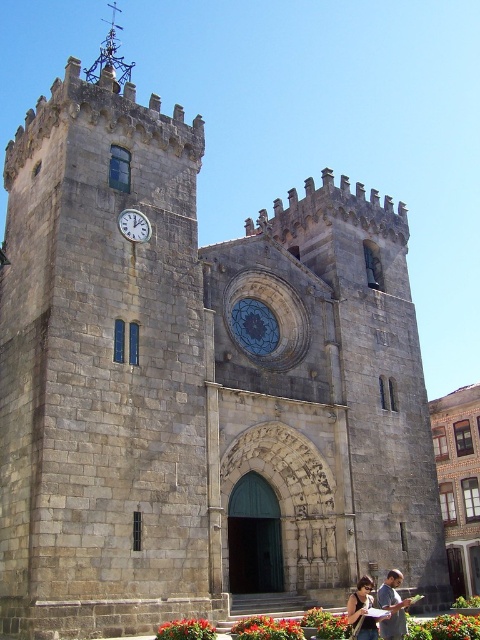
You are standing in front of the historic stone church and notice a point marked at coordinates point (381, 608). According to the image, what is this point located on?

The point (381, 608) is located on the matte gray stone couple at center.

You are an architect planning to install a new light fixture between the matte gray stone couple at center and the silver metallic clock at upper left. The light fixture requires a minimum of 2 meters of clearance between the two objects to be safely installed. Based on the distance provided, will the installation be possible?

The distance between the matte gray stone couple at center and the silver metallic clock at upper left is 23.82 meters, which is more than the required 2 meters of clearance. Therefore, the installation of the light fixture is possible.